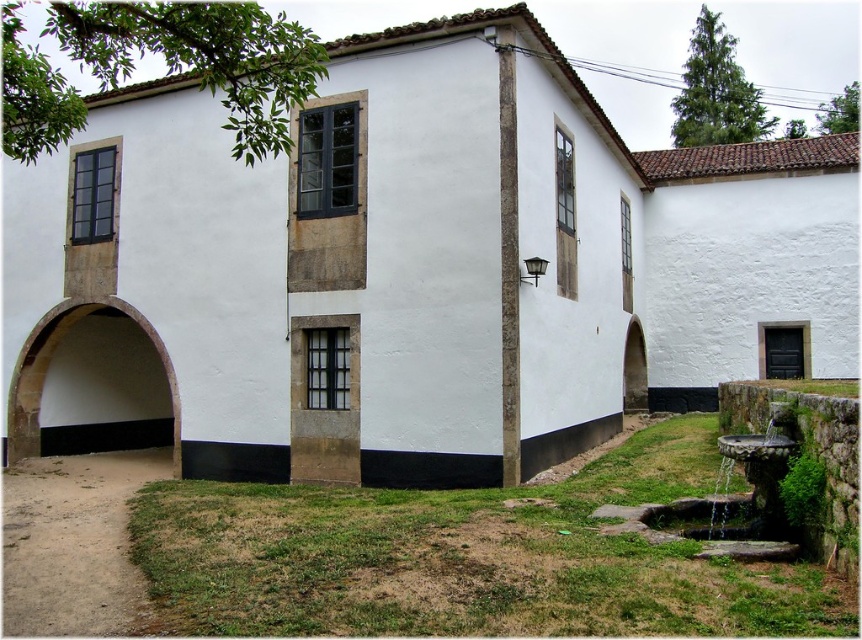
You are standing at the center of the image and want to locate the brown stone archway at lower left. According to the coordinate system where the bottom left corner is the origin, what are its coordinates?

The brown stone archway at lower left is located at coordinates point (48, 362).

You are standing in front of the traditional white building with a rustic charm. There is a point marked at coordinates point (48, 362). What does this point correspond to?

The point (48, 362) corresponds to the brown stone archway at lower left.

You are an architect examining the building and need to determine the spatial relationship between the brown stone archway at lower left and the white stone archway at right. Which archway is situated above the other?

The brown stone archway at lower left is positioned over the white stone archway at right, meaning it is above it.